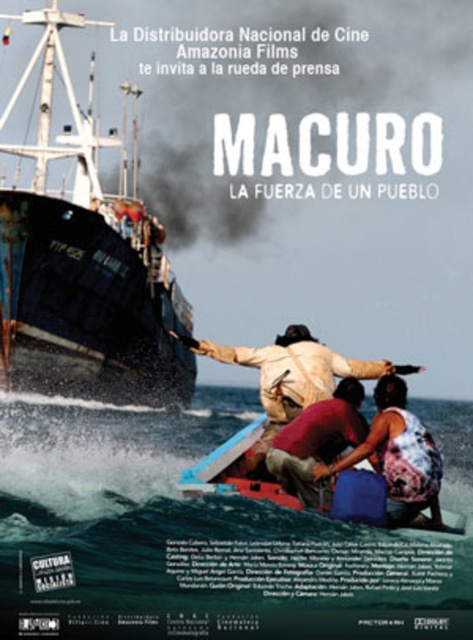
Which is more to the right, floral fabric dress at lower center or reddish-brown fabric shirt at center?

floral fabric dress at lower center

Does floral fabric dress at lower center have a lesser width compared to reddish-brown fabric shirt at center?

No.

What do you see at coordinates (397, 456) in the screenshot? The width and height of the screenshot is (473, 640). I see `floral fabric dress at lower center` at bounding box center [397, 456].

This screenshot has height=640, width=473. In order to click on floral fabric dress at lower center in this screenshot , I will do `click(397, 456)`.

Does point (316, 352) lie in front of point (316, 465)?

No, it is behind (316, 465).

This screenshot has height=640, width=473. I want to click on brown leather jacket at center, so click(290, 378).

Is the position of black matte ship at center less distant than that of reddish-brown fabric shirt at center?

No, black matte ship at center is further to the viewer.

Identify the location of black matte ship at center. This screenshot has height=640, width=473. (85, 259).

The image size is (473, 640). What do you see at coordinates (85, 259) in the screenshot?
I see `black matte ship at center` at bounding box center [85, 259].

Find the location of a particular element. This screenshot has width=473, height=640. black matte ship at center is located at coordinates (85, 259).